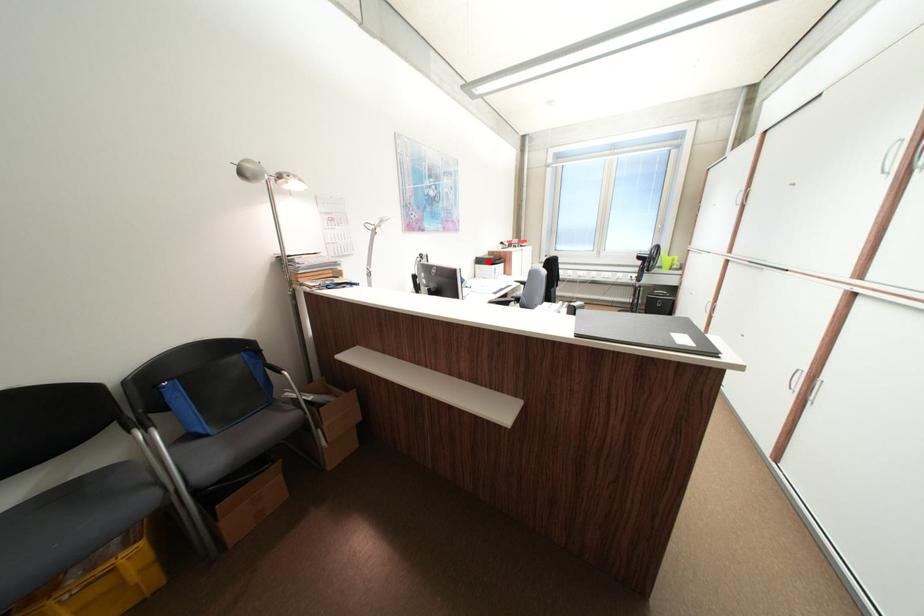
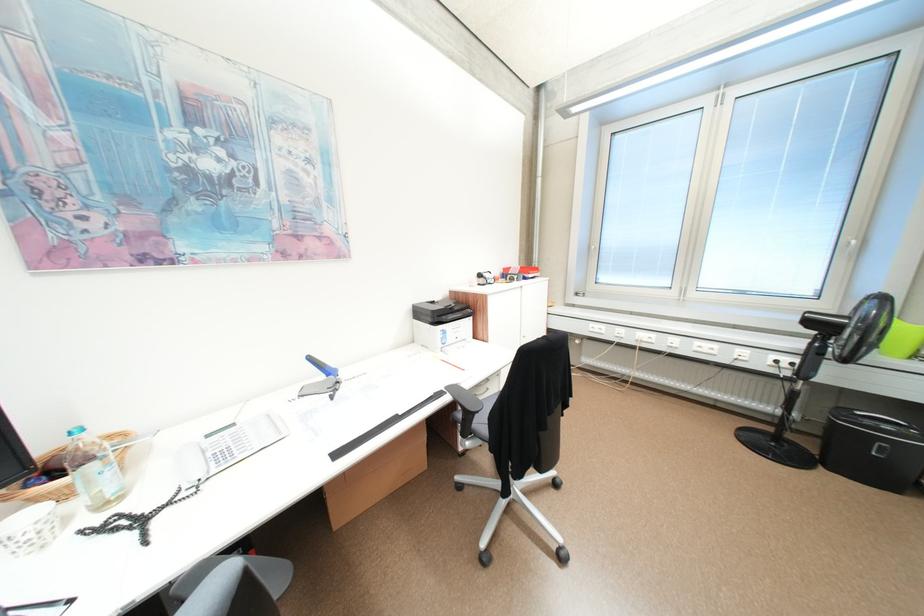
Question: I am providing you with two images of the same scene from different viewpoints. Image1 has a red point marked. In image2, the corresponding 3D location appears at what relative position? Reply with the corresponding letter.

Choices:
 (A) Closer
 (B) Farther

Answer: (B)